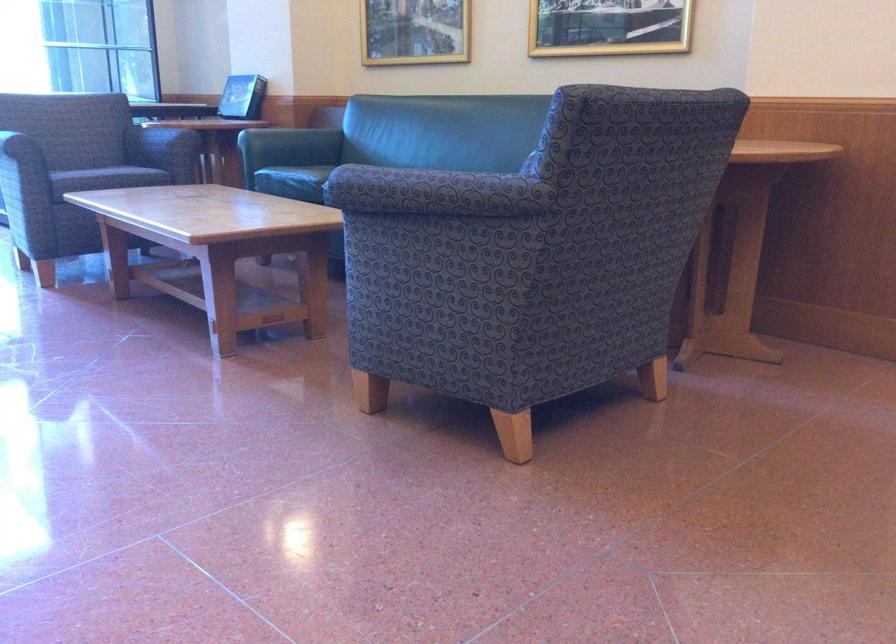
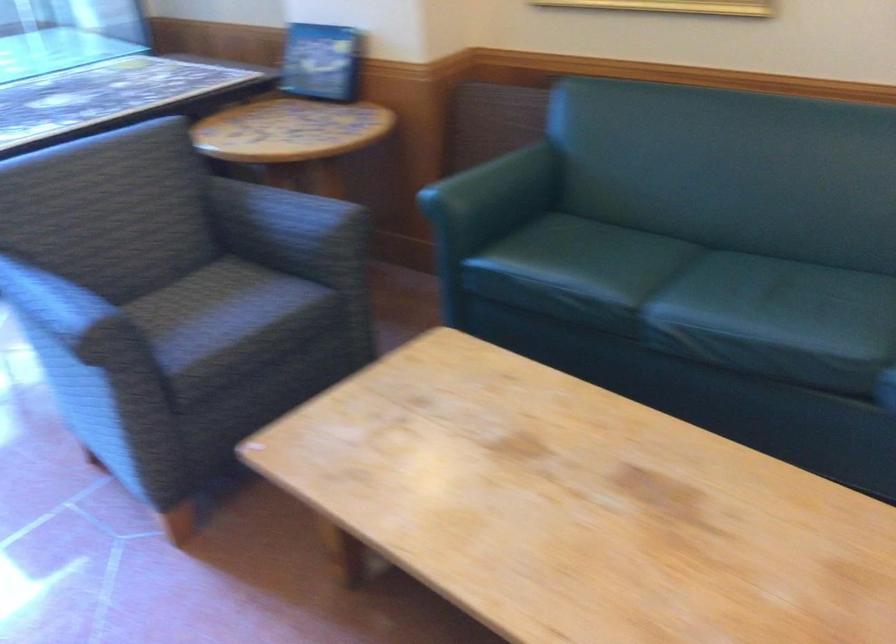
Locate, in the second image, the point that corresponds to point (281, 129) in the first image.

(496, 182)